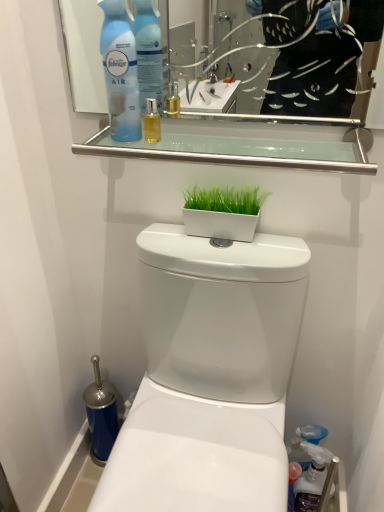
Question: Is translucent plastic spray bottle at lower right, placed as the first cleaning product when sorted from back to front, bigger than blue plastic air freshener at upper left, the first cleaning product in the left-to-right sequence?

Choices:
 (A) yes
 (B) no

Answer: (A)

Question: From the image's perspective, is translucent plastic spray bottle at lower right, which is counted as the first cleaning product, starting from the right, on top of blue plastic air freshener at upper left, which appears as the 2th cleaning product when viewed from the right?

Choices:
 (A) no
 (B) yes

Answer: (A)

Question: Is translucent plastic spray bottle at lower right, the 2th cleaning product in the left-to-right sequence, positioned with its back to blue plastic air freshener at upper left, the first cleaning product in the left-to-right sequence?

Choices:
 (A) no
 (B) yes

Answer: (A)

Question: Does translucent plastic spray bottle at lower right, the 2th cleaning product positioned from the top, come behind blue plastic air freshener at upper left, which is the 2th cleaning product in bottom-to-top order?

Choices:
 (A) yes
 (B) no

Answer: (A)

Question: Is translucent plastic spray bottle at lower right, which is counted as the first cleaning product, starting from the right, facing towards blue plastic air freshener at upper left, which is the first cleaning product in front-to-back order?

Choices:
 (A) no
 (B) yes

Answer: (A)

Question: From the image's perspective, relative to white glossy flowerpot at center, is white glossy toilet at center above or below?

Choices:
 (A) below
 (B) above

Answer: (A)

Question: Considering the positions of point (218, 467) and point (241, 218), is point (218, 467) closer or farther from the camera than point (241, 218)?

Choices:
 (A) farther
 (B) closer

Answer: (B)

Question: Is white glossy toilet at center wider or thinner than white glossy flowerpot at center?

Choices:
 (A) thin
 (B) wide

Answer: (B)

Question: Is white glossy toilet at center inside or outside of white glossy flowerpot at center?

Choices:
 (A) outside
 (B) inside

Answer: (A)

Question: Considering their positions, is blue plastic air freshener at upper left, which appears as the 1th cleaning product when viewed from the top, located in front of or behind white glossy flowerpot at center?

Choices:
 (A) behind
 (B) front

Answer: (B)

Question: Would you say blue plastic air freshener at upper left, the first cleaning product in the left-to-right sequence, is to the left or to the right of white glossy flowerpot at center in the picture?

Choices:
 (A) left
 (B) right

Answer: (A)

Question: Would you say blue plastic air freshener at upper left, which is the 2th cleaning product in bottom-to-top order, is inside or outside white glossy flowerpot at center?

Choices:
 (A) inside
 (B) outside

Answer: (B)

Question: In terms of width, does blue plastic air freshener at upper left, which is the 2th cleaning product in bottom-to-top order, look wider or thinner when compared to white glossy flowerpot at center?

Choices:
 (A) wide
 (B) thin

Answer: (A)

Question: Is translucent plastic spray bottle at lower right, which is counted as the first cleaning product, starting from the right, inside or outside of clear glass shelf at upper center?

Choices:
 (A) inside
 (B) outside

Answer: (B)

Question: Considering the positions of translucent plastic spray bottle at lower right, the 2th cleaning product in the left-to-right sequence, and clear glass shelf at upper center in the image, is translucent plastic spray bottle at lower right, the 2th cleaning product in the left-to-right sequence, wider or thinner than clear glass shelf at upper center?

Choices:
 (A) thin
 (B) wide

Answer: (A)